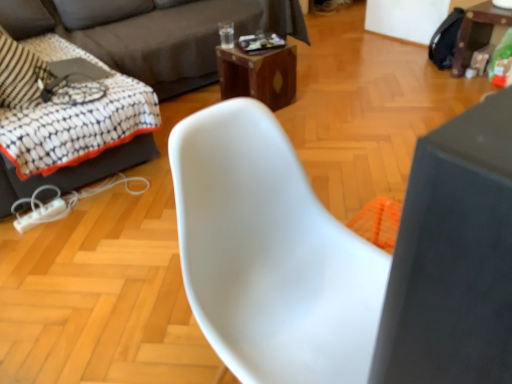
Image resolution: width=512 pixels, height=384 pixels. I want to click on free space to the left of wooden table at right, the 2th table positioned from the left, so click(x=433, y=83).